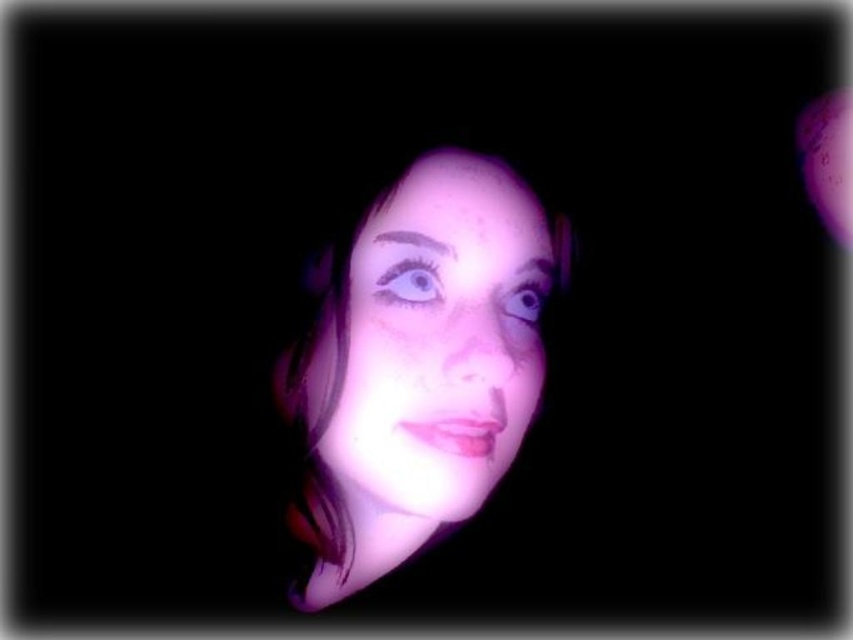
You are a photographer adjusting the lighting for a portrait. You notice the purple matte face at center and the purple glossy eye at upper center in your frame. Which object occupies more vertical space in the image?

The purple matte face at center is much taller than the purple glossy eye at upper center, so it occupies more vertical space in the image.

You are an artist analyzing the lighting in this portrait. You notice two eyes in the image. Which eye, the purple glossy eye at upper center or the shiny blue eye at center, is smaller in size?

The purple glossy eye at upper center is smaller than the shiny blue eye at center.

You are an artist analyzing the portrait. You notice two eyes in the image. Which eye has a smaller height between the purple glossy eye at upper center and the shiny blue eye at center?

The purple glossy eye at upper center has a lesser height compared to the shiny blue eye at center.